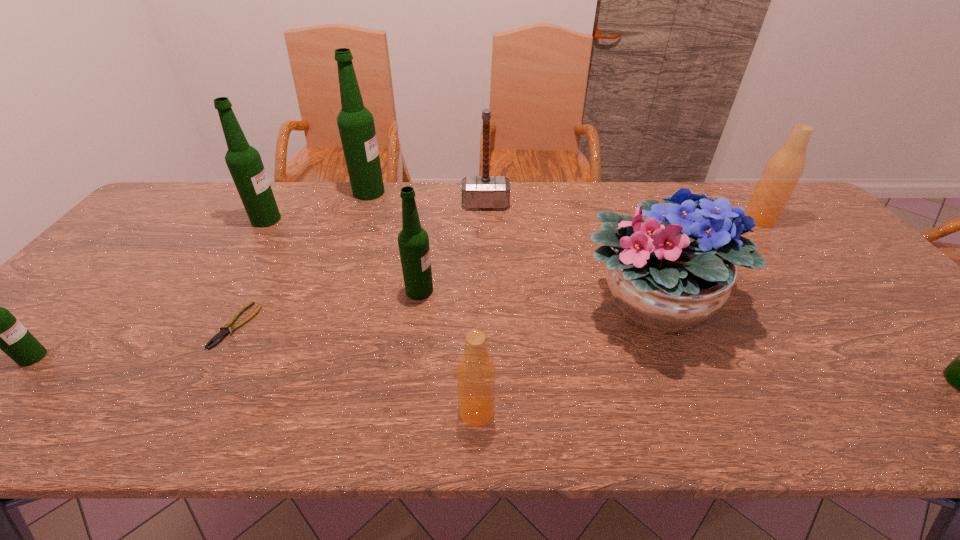
The image size is (960, 540). I want to click on free space that satisfies the following two spatial constraints: 1. on the striking surface of the farther tan beer bottle; 2. on the right side of the hammer, so click(486, 220).

Identify the location of free spot that satisfies the following two spatial constraints: 1. on the label of the second farthest green beer bottle; 2. on the right side of the eighth object from right to left. (200, 326).

Where is `free space in the image that satisfies the following two spatial constraints: 1. on the label of the shortest object; 2. on the left side of the second biggest green beer bottle`? The image size is (960, 540). free space in the image that satisfies the following two spatial constraints: 1. on the label of the shortest object; 2. on the left side of the second biggest green beer bottle is located at coordinates (200, 326).

Where is `vacant space that satisfies the following two spatial constraints: 1. on the label of the fourth green beer bottle from left to right; 2. on the left side of the left tan beer bottle`? Image resolution: width=960 pixels, height=540 pixels. vacant space that satisfies the following two spatial constraints: 1. on the label of the fourth green beer bottle from left to right; 2. on the left side of the left tan beer bottle is located at coordinates (401, 411).